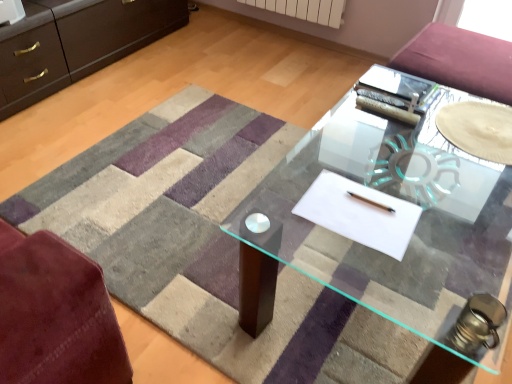
The image size is (512, 384). What are the coordinates of `transparent glass plate at center` in the screenshot? It's located at [x=478, y=129].

What do you see at coordinates (404, 200) in the screenshot? The image size is (512, 384). I see `transparent glass table at center` at bounding box center [404, 200].

Where is `transparent glass plate at center`? The image size is (512, 384). transparent glass plate at center is located at coordinates (478, 129).

How many degrees apart are the facing directions of white paper at center and transparent glass table at center?

They differ by 88 degrees in their facing directions.

Find the location of a particular element. table that is below the white paper at center (from the image's perspective) is located at coordinates (404, 200).

Which point is more distant from viewer, (391, 234) or (460, 195)?

Point (460, 195)

Consider the image. Would you say white paper at center is a long distance from transparent glass table at center?

No.

Considering the sizes of objects transparent glass table at center and white paper at center in the image provided, who is taller, transparent glass table at center or white paper at center?

Standing taller between the two is transparent glass table at center.

Which of these two, transparent glass table at center or white paper at center, is wider?

transparent glass table at center.

How many degrees apart are the facing directions of transparent glass table at center and white paper at center?

There is a 88-degree angle between the facing directions of transparent glass table at center and white paper at center.

Considering their positions, is transparent glass table at center located in front of or behind white paper at center?

In the image, transparent glass table at center appears behind white paper at center.

Which of these two, transparent glass plate at center or white paper at center, is smaller?

Smaller between the two is white paper at center.

Is transparent glass plate at center to the left or to the right of white paper at center in the image?

transparent glass plate at center is to the right of white paper at center.

From their relative heights in the image, would you say transparent glass plate at center is taller or shorter than white paper at center?

Clearly, transparent glass plate at center is taller compared to white paper at center.

Find the location of a particular element. glass plate above the white paper at center (from the image's perspective) is located at coordinates (478, 129).

Looking at their sizes, would you say transparent glass plate at center is wider or thinner than transparent glass table at center?

Considering their sizes, transparent glass plate at center looks slimmer than transparent glass table at center.

From a real-world perspective, is transparent glass plate at center above or below transparent glass table at center?

transparent glass plate at center is above transparent glass table at center.

Identify the location of table on the left of the transparent glass plate at center. (404, 200).

Which object is closer to the camera taking this photo, transparent glass plate at center or transparent glass table at center?

Positioned in front is transparent glass table at center.

How many degrees apart are the facing directions of transparent glass table at center and transparent glass plate at center?

The facing directions of transparent glass table at center and transparent glass plate at center are 88 degrees apart.

From a real-world perspective, which is physically above, transparent glass table at center or transparent glass plate at center?

transparent glass plate at center.

Is the depth of transparent glass table at center greater than that of transparent glass plate at center?

No, it is in front of transparent glass plate at center.

In terms of width, does transparent glass table at center look wider or thinner when compared to transparent glass plate at center?

In the image, transparent glass table at center appears to be wider than transparent glass plate at center.

Is the position of white paper at center more distant than that of transparent glass plate at center?

No, white paper at center is closer to the camera.

Is white paper at center placed right next to transparent glass plate at center?

No, white paper at center is not making contact with transparent glass plate at center.

Would you say white paper at center is inside or outside transparent glass plate at center?

white paper at center is not inside transparent glass plate at center, it's outside.

Measure the distance between white paper at center and transparent glass plate at center.

white paper at center and transparent glass plate at center are 19.71 inches apart.

The height and width of the screenshot is (384, 512). In order to click on table behind the white paper at center in this screenshot , I will do `click(404, 200)`.

This screenshot has width=512, height=384. I want to click on flat above the transparent glass table at center (from a real-world perspective), so click(360, 213).

Which object lies nearer to the anchor point white paper at center, transparent glass table at center or transparent glass plate at center?

Among the two, transparent glass plate at center is located nearer to white paper at center.

Looking at the image, which one is located closer to transparent glass plate at center, white paper at center or transparent glass table at center?

Among the two, transparent glass table at center is located nearer to transparent glass plate at center.

Which object lies nearer to the anchor point transparent glass plate at center, transparent glass table at center or white paper at center?

A: Based on the image, transparent glass table at center appears to be nearer to transparent glass plate at center.

In the scene shown: From the image, which object appears to be farther from transparent glass table at center, white paper at center or transparent glass plate at center?

The object further to transparent glass table at center is white paper at center.

From the image, which object appears to be farther from white paper at center, transparent glass plate at center or transparent glass table at center?

transparent glass table at center.

Considering their positions, is transparent glass plate at center positioned closer to transparent glass table at center than white paper at center?

transparent glass plate at center is positioned closer to the anchor transparent glass table at center.

Where is `flat between transparent glass table at center and transparent glass plate at center`? flat between transparent glass table at center and transparent glass plate at center is located at coordinates (360, 213).